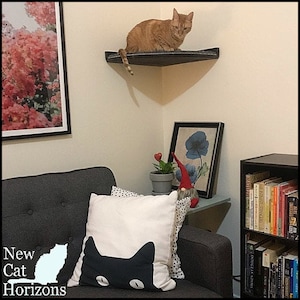
The image size is (300, 300). Find the location of `picture/painting`. picture/painting is located at coordinates (57, 73), (208, 141).